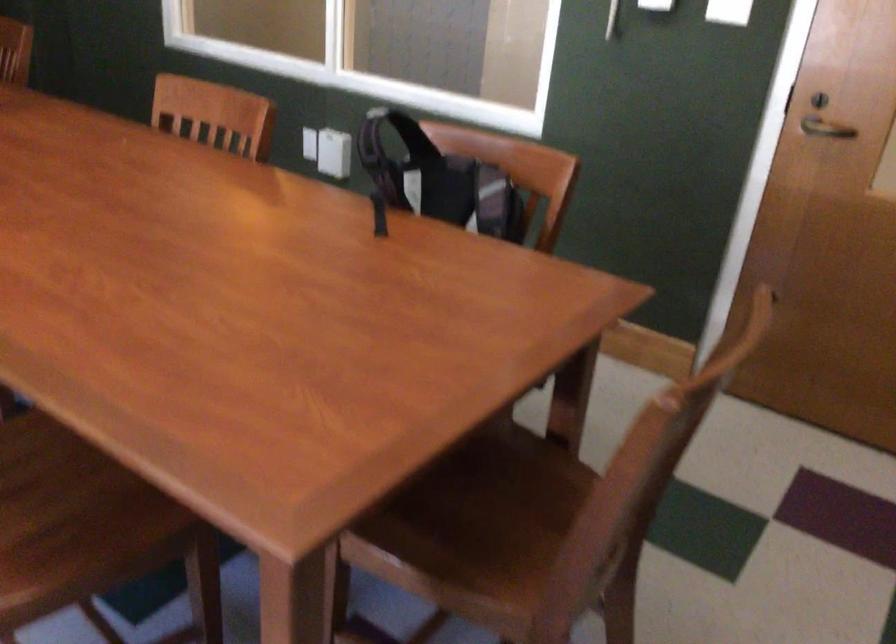
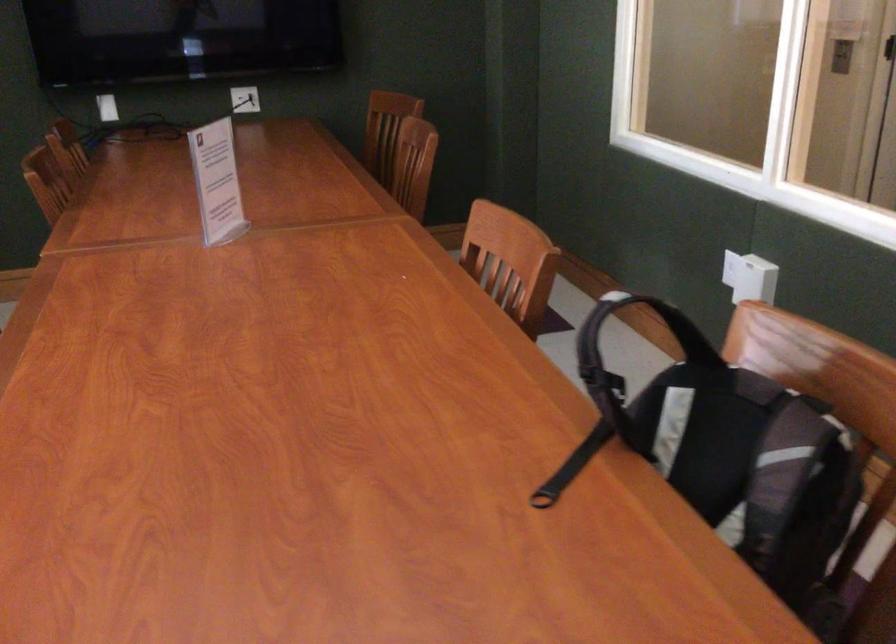
The point at (x=416, y=138) is marked in the first image. Where is the corresponding point in the second image?

(690, 337)